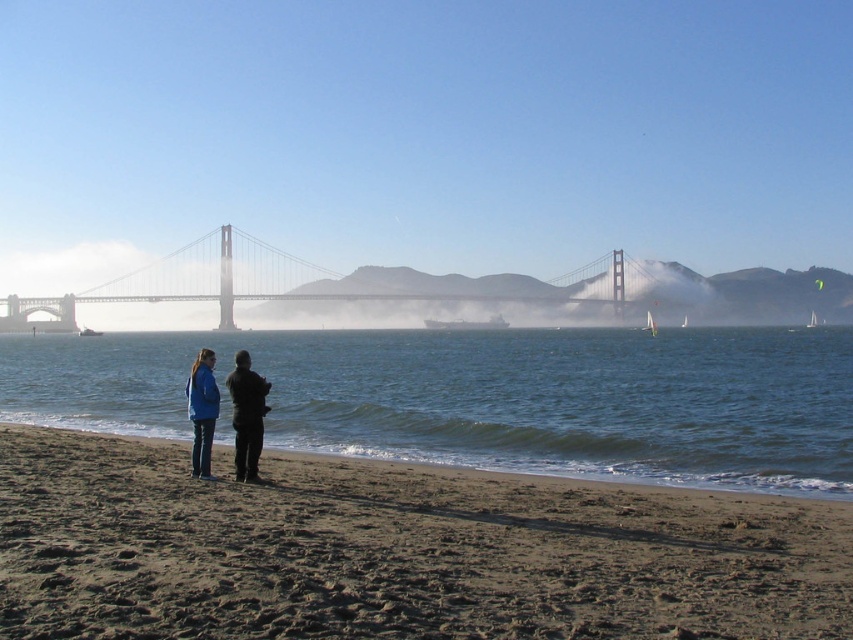
You are standing on the beach looking at the Golden Gate Bridge in the background. There is a point marked at coordinates (395, 550). What is located at this point?

The point at coordinates (395, 550) corresponds to brown sand at lower center.

You are a photographer planning to take a photo of the Golden Gate Bridge with the two people in the scene. To ensure both the brown sand at lower center and the blue fabric jacket at lower left are clearly visible, which object should you focus on first and why?

You should focus on the brown sand at lower center first because it is larger than the blue fabric jacket at lower left, making it more prominent in the composition.

You are a photographer planning to capture a landscape shot of the Golden Gate Bridge with the two people in the scene. Since you want the brown sand at lower center and the blue fabric jacket at center to be clearly visible in the photo, which object should you focus on to ensure both are in sharp focus?

To ensure both the brown sand at lower center and the blue fabric jacket at center are in sharp focus, you should focus on the blue fabric jacket at center because it is closer to the camera than the brown sand at lower center, which is farther away.